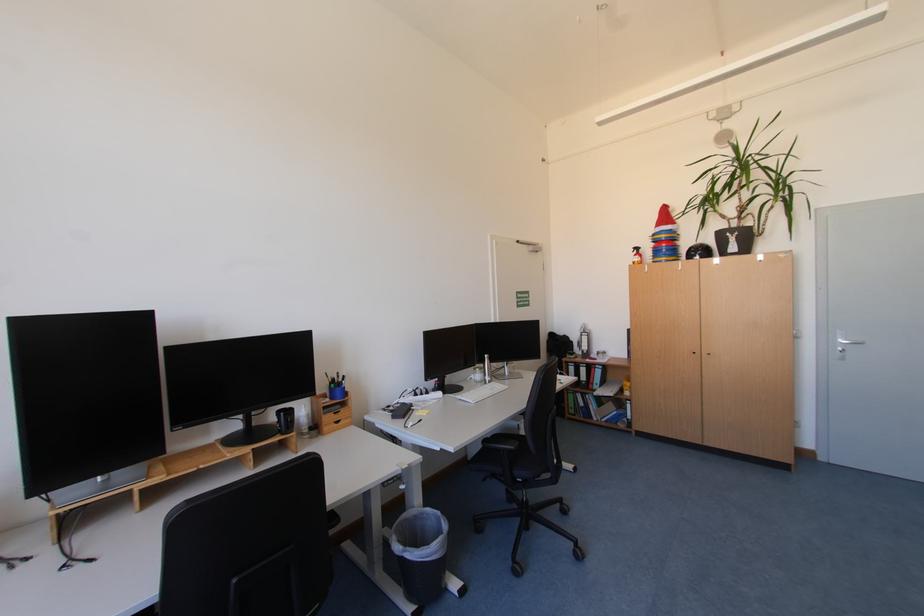
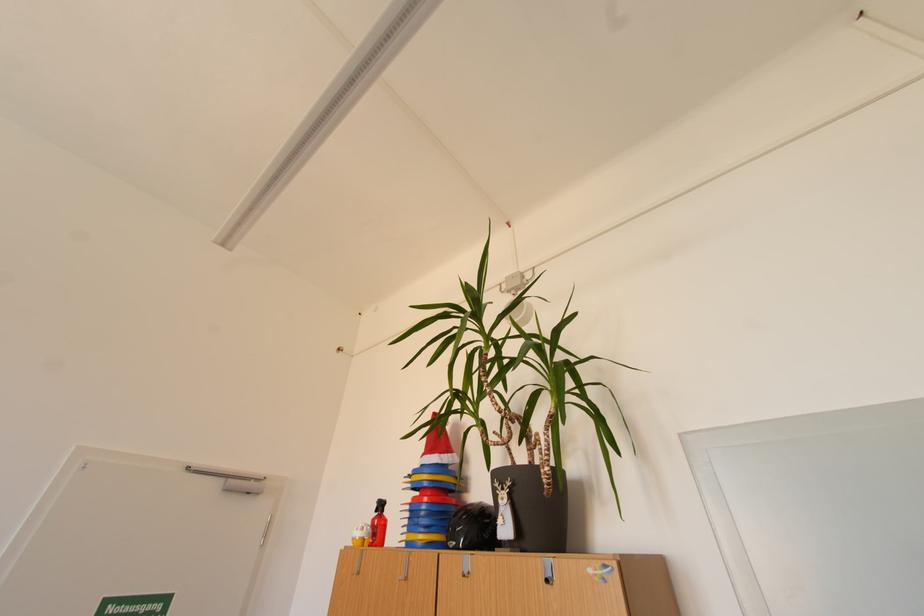
Where in the second image is the point corresponding to pixel 672 252 from the first image?

(431, 514)